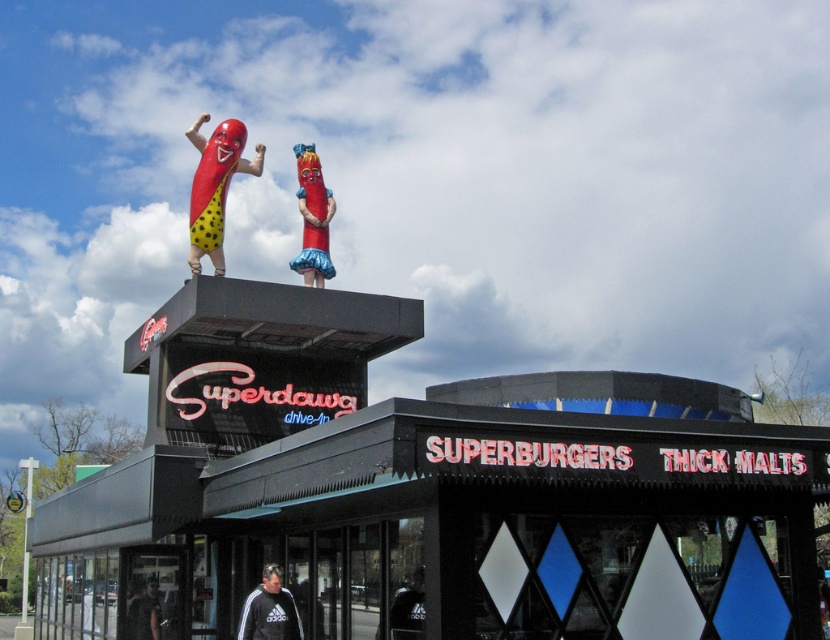
Question: Is black matte sign at upper center in front of rubberized red hot dog at upper center?

Choices:
 (A) no
 (B) yes

Answer: (B)

Question: Is black cotton sweatshirt at lower center below dark gray hoodie at lower left?

Choices:
 (A) yes
 (B) no

Answer: (B)

Question: Estimate the real-world distances between objects in this image. Which object is farther from the black matte sign at upper center?

Choices:
 (A) polka dot rubber hot dog at upper center
 (B) rubberized red hot dog at upper center

Answer: (A)

Question: Which point appears farthest from the camera in this image?

Choices:
 (A) (173, 333)
 (B) (134, 625)
 (C) (299, 161)
 (D) (208, 204)

Answer: (C)

Question: Which object appears farthest from the camera in this image?

Choices:
 (A) polka dot rubber hot dog at upper center
 (B) dark gray hoodie at lower left
 (C) rubberized red hot dog at upper center

Answer: (C)

Question: Can you confirm if polka dot rubber hot dog at upper center is bigger than rubberized red hot dog at upper center?

Choices:
 (A) no
 (B) yes

Answer: (B)